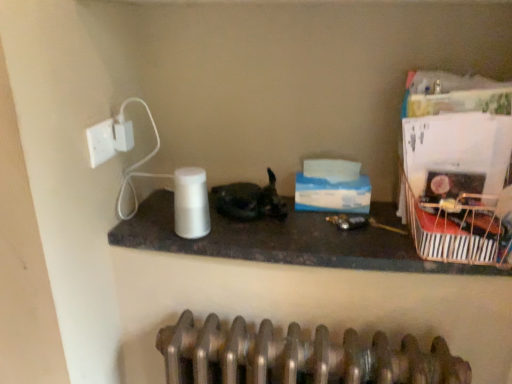
Question: Is white matte paper towel at center to the left or to the right of white plastic socket at upper left in the image?

Choices:
 (A) left
 (B) right

Answer: (B)

Question: Considering the positions of white matte paper towel at center and white plastic socket at upper left in the image, is white matte paper towel at center wider or thinner than white plastic socket at upper left?

Choices:
 (A) wide
 (B) thin

Answer: (A)

Question: Which is nearer to the white plastic electric outlet at upper left?

Choices:
 (A) shiny black cat at center
 (B) white glossy speaker at center
 (C) white matte paper towel at center
 (D) metallic striped basket at right
 (E) white plastic socket at upper left

Answer: (E)

Question: Considering the real-world distances, which object is closest to the shiny black cat at center?

Choices:
 (A) metallic striped basket at right
 (B) white plastic socket at upper left
 (C) white glossy speaker at center
 (D) white matte paper towel at center
 (E) white plastic electric outlet at upper left

Answer: (D)